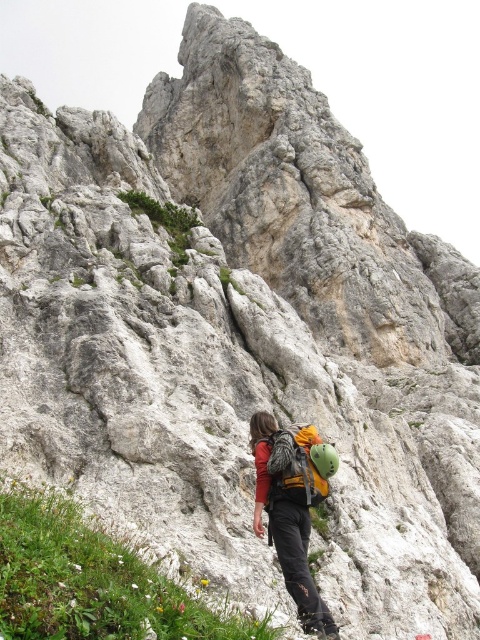
Is matte black backpack at center above matte green backpack at center?

Incorrect, matte black backpack at center is not positioned above matte green backpack at center.

Does point (310, 460) come closer to viewer compared to point (319, 476)?

That is False.

Locate an element on the screen. The height and width of the screenshot is (640, 480). matte black backpack at center is located at coordinates [x=290, y=509].

Between point (103, 576) and point (323, 456), which one is positioned behind?

The point (323, 456) is more distant.

From the picture: Measure the distance from green grass at lower left to matte green backpack at center.

green grass at lower left and matte green backpack at center are 10.55 meters apart from each other.

Locate an element on the screen. The image size is (480, 640). green grass at lower left is located at coordinates (93, 580).

Where is `green grass at lower left`? This screenshot has width=480, height=640. green grass at lower left is located at coordinates (93, 580).

Who is positioned more to the right, green grass at lower left or matte black backpack at center?

matte black backpack at center

Who is higher up, green grass at lower left or matte black backpack at center?

Positioned higher is matte black backpack at center.

Where is `green grass at lower left`? This screenshot has height=640, width=480. green grass at lower left is located at coordinates (93, 580).

The image size is (480, 640). In order to click on green grass at lower left in this screenshot , I will do `click(93, 580)`.